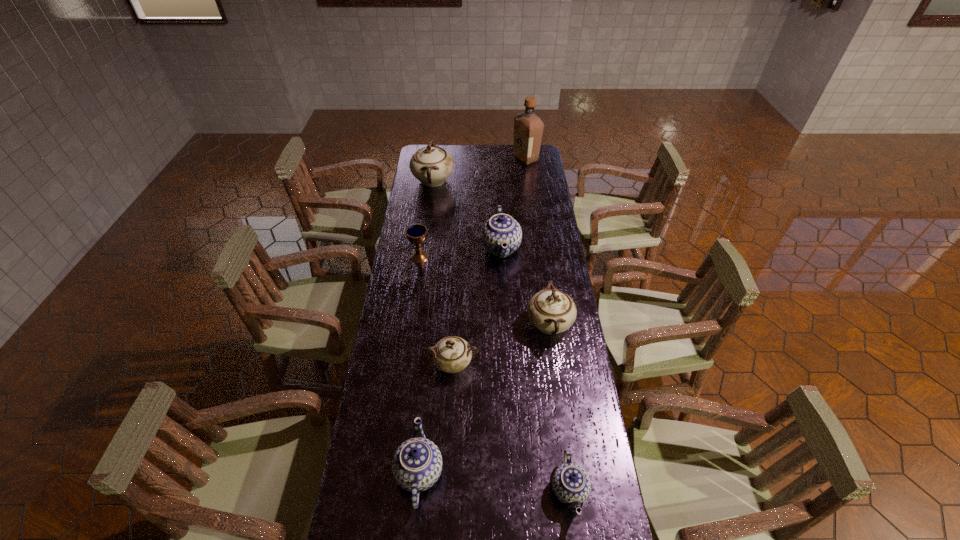
You are a GUI agent. You are given a task and a screenshot of the screen. Output one action in this format:
    pyautogui.click(x=<x>, y=<y>)
    Task: Click on the shortest chinaware
    
    Given the screenshot: What is the action you would take?
    pyautogui.click(x=571, y=484)

Where is `the rightmost blue chinaware`? The image size is (960, 540). the rightmost blue chinaware is located at coordinates (571, 484).

I want to click on free space located on the front-facing side of the tallest object, so click(x=500, y=158).

Image resolution: width=960 pixels, height=540 pixels. I want to click on vacant space located on the front-facing side of the tallest object, so click(x=442, y=158).

You are a GUI agent. You are given a task and a screenshot of the screen. Output one action in this format:
    pyautogui.click(x=<x>, y=<y>)
    Task: Click on the free space located on the front-facing side of the tallest object
    The image size is (960, 540).
    Given the screenshot: What is the action you would take?
    point(496,158)

This screenshot has height=540, width=960. What are the coordinates of `vacant space located 0.130m on the right of the seventh shortest object` in the screenshot? It's located at (479, 181).

You are a GUI agent. You are given a task and a screenshot of the screen. Output one action in this format:
    pyautogui.click(x=<x>, y=<y>)
    Task: Click on the vacant region located on the back of the rightmost white chinaware
    
    Given the screenshot: What is the action you would take?
    pyautogui.click(x=544, y=289)

Find the location of `free space located at the spout of the second blue chinaware from right to left`. free space located at the spout of the second blue chinaware from right to left is located at coordinates (444, 247).

Locate an element on the screen. Image resolution: width=960 pixels, height=540 pixels. vacant space situated at the spout of the second blue chinaware from right to left is located at coordinates (461, 247).

Identify the location of free space located at the spout of the second blue chinaware from right to left. Image resolution: width=960 pixels, height=540 pixels. pos(450,247).